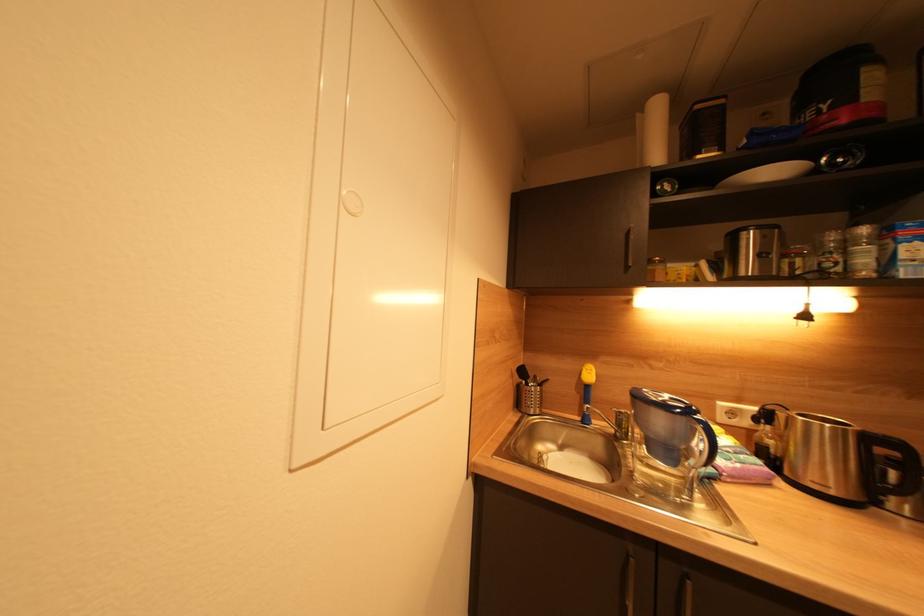
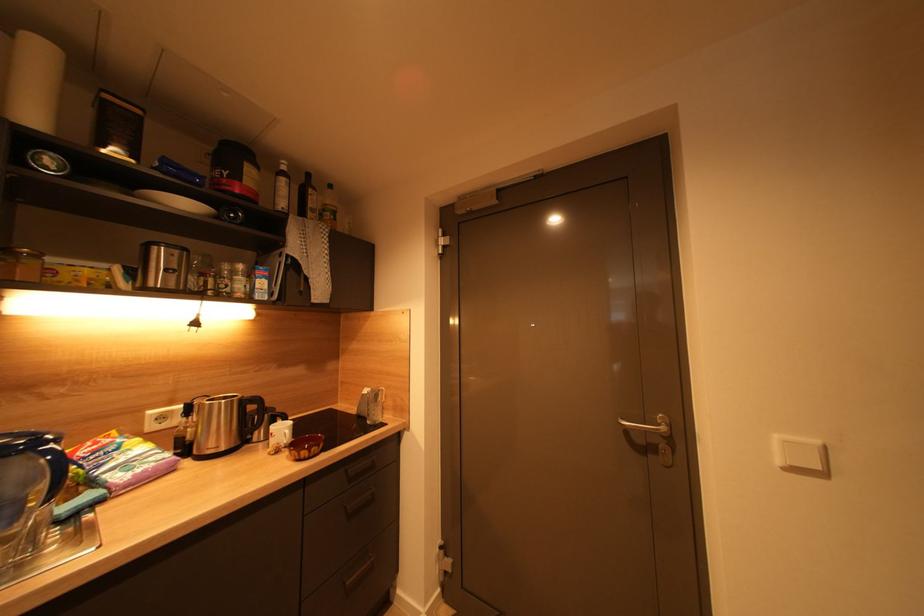
Question: How did the camera likely rotate?

Choices:
 (A) Left
 (B) Right
 (C) Up
 (D) Down

Answer: (B)